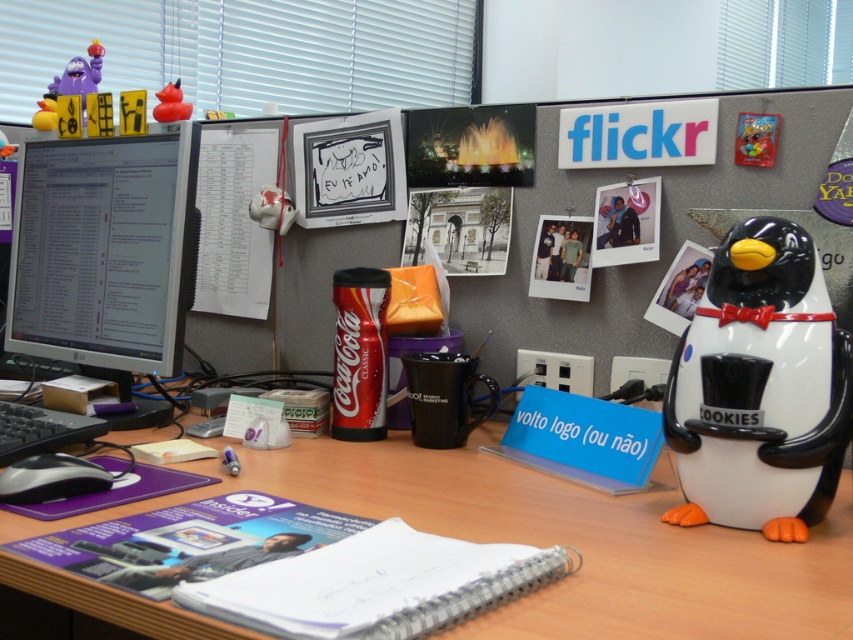
You are a delivery robot with a package that is 18 inches wide. You need to place it on the desk between the wooden at center and the matte black monitor at left. Is there enough space for the package?

The wooden at center is 16.65 inches from the matte black monitor at left, so the space between them is only 16.65 inches. Since the package is 18 inches wide, it won

You are organizing the desk and need to place a new item between the wooden at center and the white paper at upper center. Considering their sizes, which object should you place closer to the edge of the desk to ensure stability?

The wooden at center is larger in size than the white paper at upper center, so placing the wooden at center closer to the edge would provide better stability due to its larger base area.